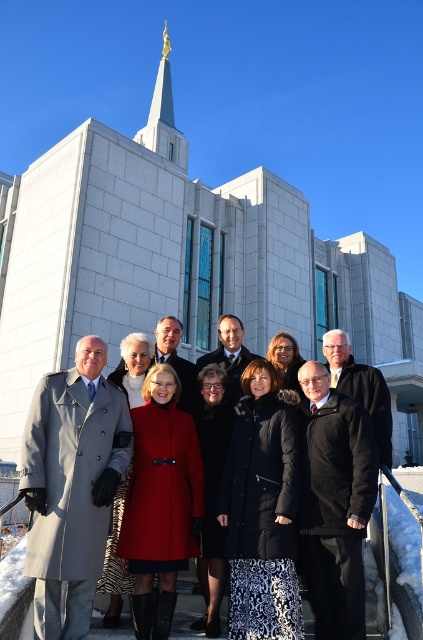
Question: Estimate the real-world distances between objects in this image. Which object is closer to the white stone church at center?

Choices:
 (A) red wool coat at center
 (B) gold metallic spire at upper center

Answer: (A)

Question: Does white stone church at center have a lesser width compared to gold metallic spire at upper center?

Choices:
 (A) no
 (B) yes

Answer: (A)

Question: Observing the image, what is the correct spatial positioning of white stone church at center in reference to red wool coat at center?

Choices:
 (A) left
 (B) right

Answer: (B)

Question: Among these objects, which one is nearest to the camera?

Choices:
 (A) white stone church at center
 (B) red wool coat at center

Answer: (B)

Question: Does white stone church at center appear on the left side of red wool coat at center?

Choices:
 (A) no
 (B) yes

Answer: (A)

Question: Which point is farther to the camera?

Choices:
 (A) (213, 241)
 (B) (280, 378)

Answer: (A)